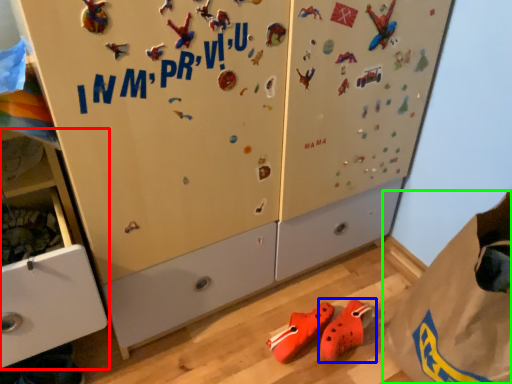
Question: Estimate the real-world distances between objects in this image. Which object is farther from cabinetry (highlighted by a red box), footwear (highlighted by a blue box) or paper bag (highlighted by a green box)?

Choices:
 (A) footwear
 (B) paper bag

Answer: (B)